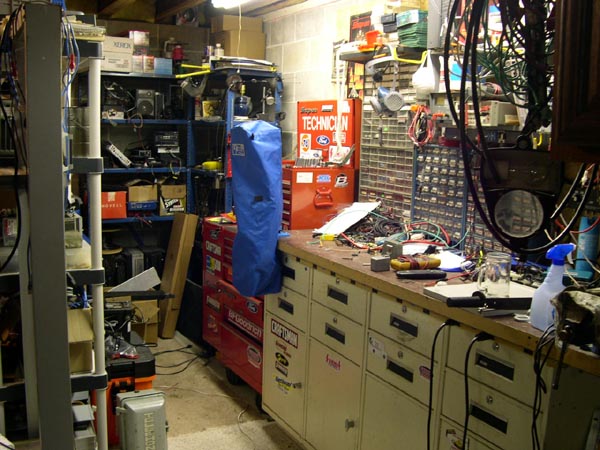
You are a GUI agent. You are given a task and a screenshot of the screen. Output one action in this format:
    pyautogui.click(x=<x>, y=<y>)
    Task: Click on the cord for light
    
    Given the screenshot: What is the action you would take?
    [x=237, y=72]